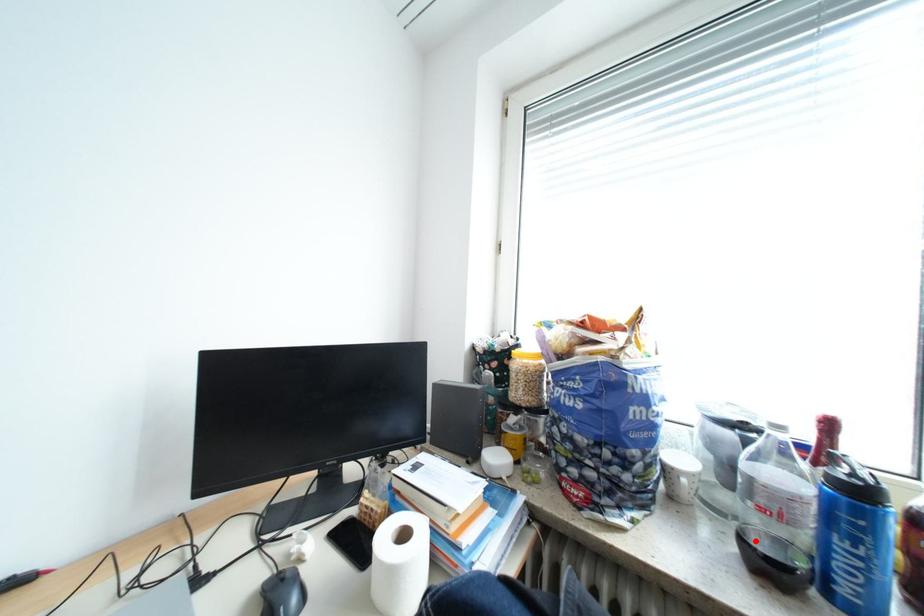
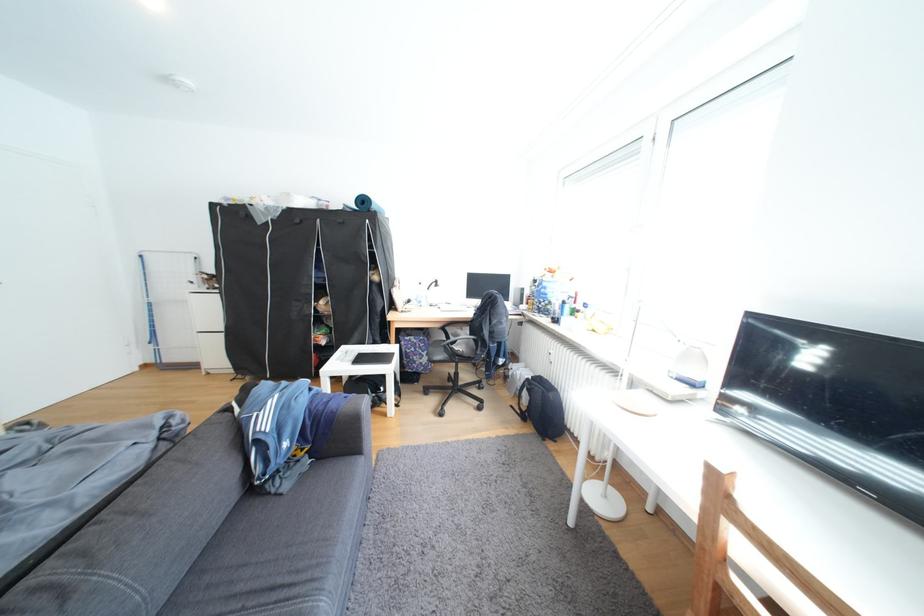
Question: I am providing you with two images of the same scene from different viewpoints. A red point is marked on the first image. Is the red point's position out of view in image 2?

Choices:
 (A) Yes
 (B) No

Answer: (A)